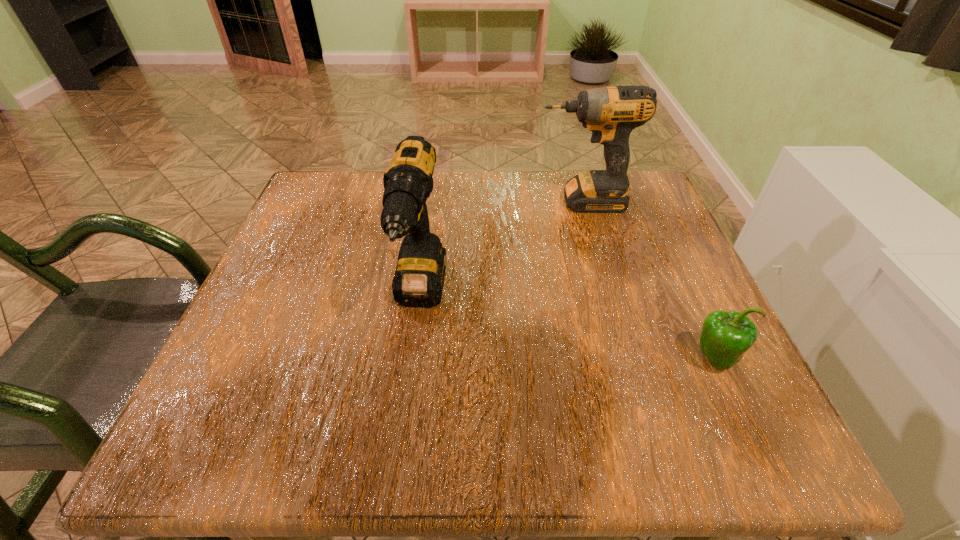
Where is `vacant space that satisfies the following two spatial constraints: 1. with the drill bit of the right drill facing forward; 2. on the right side of the bell pepper`? The image size is (960, 540). vacant space that satisfies the following two spatial constraints: 1. with the drill bit of the right drill facing forward; 2. on the right side of the bell pepper is located at coordinates (626, 358).

You are a GUI agent. You are given a task and a screenshot of the screen. Output one action in this format:
    pyautogui.click(x=<x>, y=<y>)
    Task: Click on the free space that satisfies the following two spatial constraints: 1. at the tip of the shortest object; 2. on the left side of the nearer drill
    The height and width of the screenshot is (540, 960).
    Given the screenshot: What is the action you would take?
    pyautogui.click(x=412, y=358)

I want to click on vacant space that satisfies the following two spatial constraints: 1. at the tip of the shortest object; 2. on the right side of the left drill, so click(412, 358).

Image resolution: width=960 pixels, height=540 pixels. Identify the location of free space that satisfies the following two spatial constraints: 1. at the tip of the shortest object; 2. on the left side of the nearer drill. (412, 358).

Locate an element on the screen. Image resolution: width=960 pixels, height=540 pixels. vacant region that satisfies the following two spatial constraints: 1. with the drill bit of the right drill facing forward; 2. on the right side of the bell pepper is located at coordinates (626, 358).

Locate an element on the screen. The height and width of the screenshot is (540, 960). vacant region that satisfies the following two spatial constraints: 1. with the drill bit of the farthest object facing forward; 2. at the tip of the left drill is located at coordinates (609, 298).

The image size is (960, 540). What are the coordinates of `free space that satisfies the following two spatial constraints: 1. with the drill bit of the farthest object facing forward; 2. at the tip of the left drill` in the screenshot? It's located at pyautogui.click(x=609, y=298).